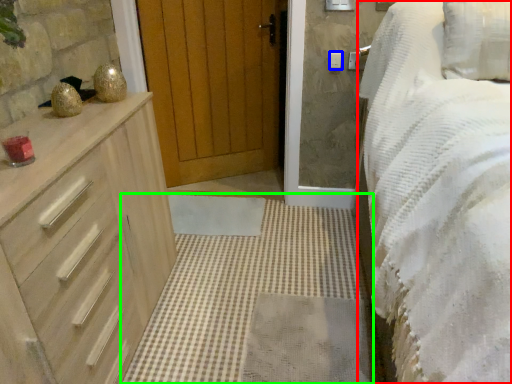
Question: Based on their relative distances, which object is nearer to bed (highlighted by a red box)? Choose from light switch (highlighted by a blue box) and plain (highlighted by a green box).

Choices:
 (A) light switch
 (B) plain

Answer: (B)